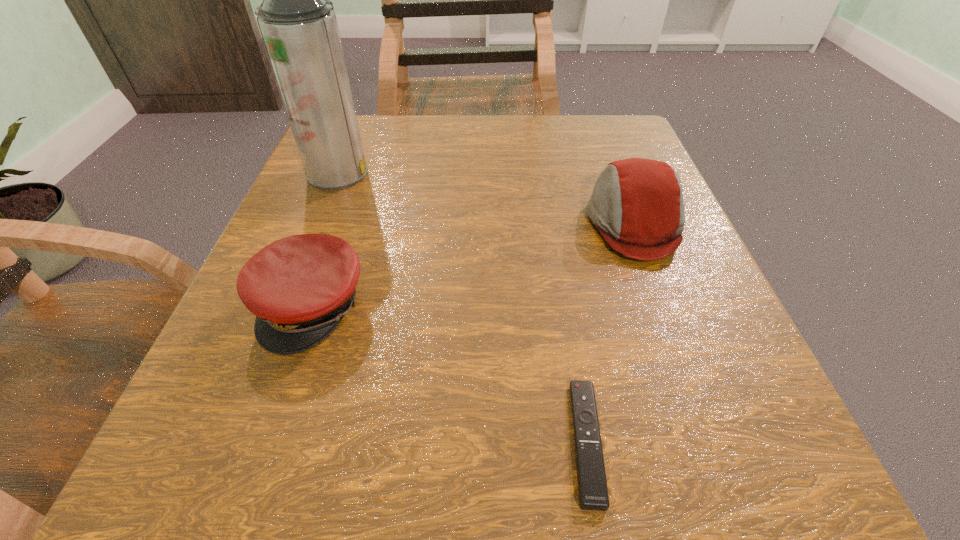
I want to click on free space between the shorter cap and the second object from right to left, so click(449, 374).

The width and height of the screenshot is (960, 540). I want to click on free space between the remote control and the right cap, so point(610,332).

I want to click on object that is the second closest to the left cap, so click(592, 485).

You are a GUI agent. You are given a task and a screenshot of the screen. Output one action in this format:
    pyautogui.click(x=<x>, y=<y>)
    Task: Click on the object that ranks as the third closest to the aerosol can
    The width and height of the screenshot is (960, 540).
    Given the screenshot: What is the action you would take?
    pyautogui.click(x=592, y=485)

Find the location of a particular element. The height and width of the screenshot is (540, 960). free region that satisfies the following two spatial constraints: 1. on the front-facing side of the third shortest object; 2. on the front side of the remote control is located at coordinates (716, 441).

Image resolution: width=960 pixels, height=540 pixels. I want to click on vacant area that satisfies the following two spatial constraints: 1. on the front-facing side of the rightmost object; 2. on the front of the shorter cap with an emblem, so click(665, 307).

Image resolution: width=960 pixels, height=540 pixels. What are the coordinates of `free space in the image that satisfies the following two spatial constraints: 1. on the front of the second object from right to left with an emblem; 2. on the left side of the shorter cap` in the screenshot? It's located at (266, 441).